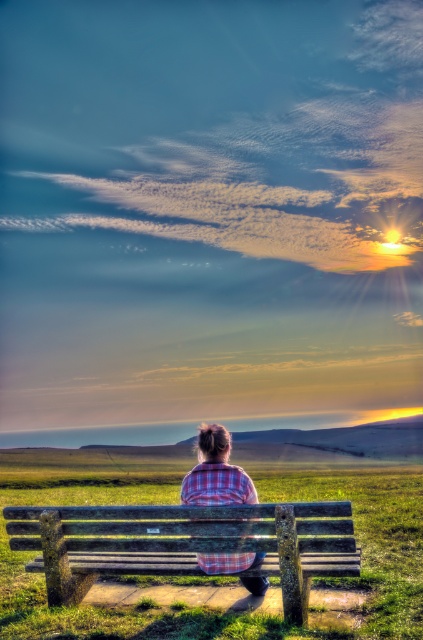
Is wooden bench at center shorter than plaid fabric shirt at center?

No.

Between point (41, 548) and point (211, 424), which one is positioned behind?

Point (211, 424)

Find the location of a particular element. The width and height of the screenshot is (423, 640). wooden bench at center is located at coordinates (186, 544).